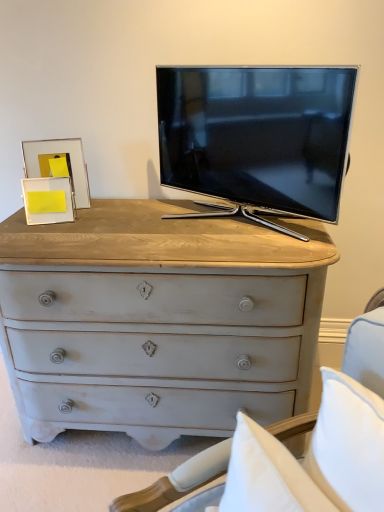
Find the location of a particular element. This screenshot has height=512, width=384. yellow paper at left, the second picture frame viewed from the back is located at coordinates (48, 200).

In order to face matte black tv at center, should I rotate leftwards or rightwards?

To face it directly, rotate right by 7.145 degrees.

Identify the location of gold metallic picture frame at upper left, arranged as the second picture frame when viewed from the front. (57, 158).

I want to click on distressed white chest of drawers at center, so click(158, 321).

Between yellow paper at left, which ranks as the 1th picture frame in front-to-back order, and distressed white chest of drawers at center, which one appears on the left side from the viewer's perspective?

yellow paper at left, which ranks as the 1th picture frame in front-to-back order.

Is yellow paper at left, which ranks as the 1th picture frame in front-to-back order, oriented towards distressed white chest of drawers at center?

No.

Consider the image. Can distressed white chest of drawers at center be found inside yellow paper at left, which ranks as the 1th picture frame in front-to-back order?

No, yellow paper at left, which ranks as the 1th picture frame in front-to-back order, does not contain distressed white chest of drawers at center.

From a real-world perspective, who is located lower, yellow paper at left, the second picture frame viewed from the back, or distressed white chest of drawers at center?

distressed white chest of drawers at center.

Who is more distant, gold metallic picture frame at upper left, arranged as the second picture frame when viewed from the front, or distressed white chest of drawers at center?

gold metallic picture frame at upper left, arranged as the second picture frame when viewed from the front, is further away from the camera.

What's the angular difference between gold metallic picture frame at upper left, which is counted as the 1th picture frame, starting from the back, and distressed white chest of drawers at center's facing directions?

73.8 degrees.

Is point (71, 165) less distant than point (57, 415)?

That is False.

From a real-world perspective, is gold metallic picture frame at upper left, arranged as the second picture frame when viewed from the front, over distressed white chest of drawers at center?

Yes, from a real-world perspective, gold metallic picture frame at upper left, arranged as the second picture frame when viewed from the front, is over distressed white chest of drawers at center

Looking at this image, between distressed white chest of drawers at center and yellow paper at left, which ranks as the 1th picture frame in front-to-back order, which one has larger size?

distressed white chest of drawers at center is bigger.

In the image, is distressed white chest of drawers at center positioned in front of or behind yellow paper at left, the second picture frame viewed from the back?

distressed white chest of drawers at center is positioned closer to the viewer than yellow paper at left, the second picture frame viewed from the back.

Image resolution: width=384 pixels, height=512 pixels. I want to click on the chest of drawers in front of the yellow paper at left, the second picture frame viewed from the back, so click(x=158, y=321).

Are distressed white chest of drawers at center and yellow paper at left, which ranks as the 1th picture frame in front-to-back order, far apart?

No, there isn't a large distance between distressed white chest of drawers at center and yellow paper at left, which ranks as the 1th picture frame in front-to-back order.

Does matte black tv at center have a larger size compared to gold metallic picture frame at upper left, which is counted as the 1th picture frame, starting from the back?

Yes.

Is matte black tv at center oriented away from gold metallic picture frame at upper left, arranged as the second picture frame when viewed from the front?

No, matte black tv at center is not facing away from gold metallic picture frame at upper left, arranged as the second picture frame when viewed from the front.

In the scene shown: Is matte black tv at center outside of gold metallic picture frame at upper left, arranged as the second picture frame when viewed from the front?

Yes, matte black tv at center is outside of gold metallic picture frame at upper left, arranged as the second picture frame when viewed from the front.

Is distressed white chest of drawers at center shorter than gold metallic picture frame at upper left, which is counted as the 1th picture frame, starting from the back?

Incorrect, the height of distressed white chest of drawers at center does not fall short of that of gold metallic picture frame at upper left, which is counted as the 1th picture frame, starting from the back.

From a real-world perspective, between distressed white chest of drawers at center and gold metallic picture frame at upper left, arranged as the second picture frame when viewed from the front, who is vertically higher?

gold metallic picture frame at upper left, arranged as the second picture frame when viewed from the front.

From the image's perspective, which picture frame is the 2nd one above the distressed white chest of drawers at center? Please provide its 2D coordinates.

[(57, 158)]

Measure the distance between gold metallic picture frame at upper left, which is counted as the 1th picture frame, starting from the back, and matte black tv at center.

gold metallic picture frame at upper left, which is counted as the 1th picture frame, starting from the back, is 23.60 inches from matte black tv at center.

Which is in front, gold metallic picture frame at upper left, arranged as the second picture frame when viewed from the front, or matte black tv at center?

matte black tv at center is in front.

Does gold metallic picture frame at upper left, arranged as the second picture frame when viewed from the front, appear on the right side of matte black tv at center?

In fact, gold metallic picture frame at upper left, arranged as the second picture frame when viewed from the front, is to the left of matte black tv at center.

Which of these two, gold metallic picture frame at upper left, which is counted as the 1th picture frame, starting from the back, or matte black tv at center, is smaller?

Smaller between the two is gold metallic picture frame at upper left, which is counted as the 1th picture frame, starting from the back.

Looking at this image, is matte black tv at center oriented towards yellow paper at left, which ranks as the 1th picture frame in front-to-back order?

No, matte black tv at center is not facing towards yellow paper at left, which ranks as the 1th picture frame in front-to-back order.

Would you say yellow paper at left, the second picture frame viewed from the back, is part of matte black tv at center's contents?

No, matte black tv at center does not contain yellow paper at left, the second picture frame viewed from the back.

Which of these two, matte black tv at center or yellow paper at left, the second picture frame viewed from the back, stands shorter?

With less height is yellow paper at left, the second picture frame viewed from the back.

Considering the relative sizes of matte black tv at center and yellow paper at left, the second picture frame viewed from the back, in the image provided, is matte black tv at center thinner than yellow paper at left, the second picture frame viewed from the back,?

No, matte black tv at center is not thinner than yellow paper at left, the second picture frame viewed from the back.

The image size is (384, 512). I want to click on chest of drawers on the right of yellow paper at left, the second picture frame viewed from the back, so click(x=158, y=321).

Locate an element on the screen. The image size is (384, 512). the chest of drawers that is under the gold metallic picture frame at upper left, which is counted as the 1th picture frame, starting from the back (from a real-world perspective) is located at coordinates tap(158, 321).

From the image, which object appears to be nearer to gold metallic picture frame at upper left, arranged as the second picture frame when viewed from the front, matte black tv at center or distressed white chest of drawers at center?

distressed white chest of drawers at center is closer to gold metallic picture frame at upper left, arranged as the second picture frame when viewed from the front.

Considering their positions, is matte black tv at center positioned further to yellow paper at left, which ranks as the 1th picture frame in front-to-back order, than distressed white chest of drawers at center?

matte black tv at center is further to yellow paper at left, which ranks as the 1th picture frame in front-to-back order.

Which object lies further to the anchor point distressed white chest of drawers at center, matte black tv at center or yellow paper at left, which ranks as the 1th picture frame in front-to-back order?

yellow paper at left, which ranks as the 1th picture frame in front-to-back order, is positioned further to the anchor distressed white chest of drawers at center.

Which object lies further to the anchor point gold metallic picture frame at upper left, which is counted as the 1th picture frame, starting from the back, yellow paper at left, which ranks as the 1th picture frame in front-to-back order, or distressed white chest of drawers at center?

Based on the image, distressed white chest of drawers at center appears to be further to gold metallic picture frame at upper left, which is counted as the 1th picture frame, starting from the back.

Based on the photo, which object lies further to the anchor point distressed white chest of drawers at center, yellow paper at left, the second picture frame viewed from the back, or matte black tv at center?

yellow paper at left, the second picture frame viewed from the back.

Looking at the image, which one is located further to gold metallic picture frame at upper left, arranged as the second picture frame when viewed from the front, matte black tv at center or yellow paper at left, which ranks as the 1th picture frame in front-to-back order?

The object further to gold metallic picture frame at upper left, arranged as the second picture frame when viewed from the front, is matte black tv at center.

Based on their spatial positions, is matte black tv at center or gold metallic picture frame at upper left, which is counted as the 1th picture frame, starting from the back, further from distressed white chest of drawers at center?

gold metallic picture frame at upper left, which is counted as the 1th picture frame, starting from the back, lies further to distressed white chest of drawers at center than the other object.

Estimate the real-world distances between objects in this image. Which object is closer to yellow paper at left, the second picture frame viewed from the back, gold metallic picture frame at upper left, which is counted as the 1th picture frame, starting from the back, or matte black tv at center?

The object closer to yellow paper at left, the second picture frame viewed from the back, is gold metallic picture frame at upper left, which is counted as the 1th picture frame, starting from the back.

The height and width of the screenshot is (512, 384). I want to click on television positioned between distressed white chest of drawers at center and yellow paper at left, which ranks as the 1th picture frame in front-to-back order, from near to far, so click(x=257, y=139).

The image size is (384, 512). I want to click on television between distressed white chest of drawers at center and gold metallic picture frame at upper left, arranged as the second picture frame when viewed from the front, in the front-back direction, so click(x=257, y=139).

Locate an element on the screen. picture frame between gold metallic picture frame at upper left, which is counted as the 1th picture frame, starting from the back, and matte black tv at center is located at coordinates (48, 200).

At what (x,y) coordinates should I click in order to perform the action: click on picture frame between distressed white chest of drawers at center and gold metallic picture frame at upper left, arranged as the second picture frame when viewed from the front, along the z-axis. Please return your answer as a coordinate pair (x, y). This screenshot has width=384, height=512. Looking at the image, I should click on (48, 200).